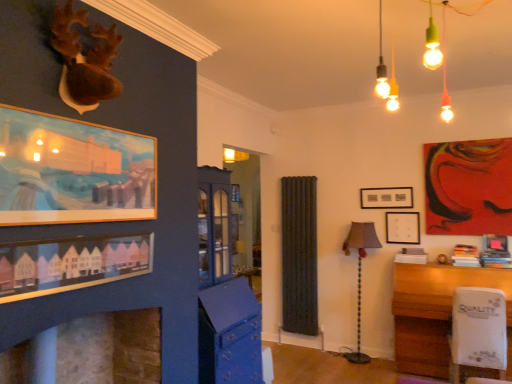
Question: From a real-world perspective, does stone fireplace at lower left sit lower than matte black picture frame at center, which is the third picture frame from right to left?

Choices:
 (A) no
 (B) yes

Answer: (B)

Question: Is stone fireplace at lower left outside matte black picture frame at center, acting as the fifth picture frame starting from the front?

Choices:
 (A) yes
 (B) no

Answer: (A)

Question: Is stone fireplace at lower left aimed at matte black picture frame at center, acting as the fifth picture frame starting from the front?

Choices:
 (A) yes
 (B) no

Answer: (B)

Question: Is the depth of stone fireplace at lower left greater than that of matte black picture frame at center, the 3th picture frame when ordered from left to right?

Choices:
 (A) yes
 (B) no

Answer: (B)

Question: Can you confirm if stone fireplace at lower left is bigger than matte black picture frame at center, the 3th picture frame when ordered from left to right?

Choices:
 (A) no
 (B) yes

Answer: (B)

Question: Can you confirm if stone fireplace at lower left is wider than matte black picture frame at center, the first picture frame viewed from the back?

Choices:
 (A) yes
 (B) no

Answer: (A)

Question: Can you confirm if stone fireplace at lower left is shorter than wooden framed painting at upper left, marked as the second picture frame in a front-to-back arrangement?

Choices:
 (A) yes
 (B) no

Answer: (A)

Question: Is stone fireplace at lower left behind wooden framed painting at upper left, placed as the fifth picture frame when sorted from right to left?

Choices:
 (A) yes
 (B) no

Answer: (A)

Question: From the image's perspective, would you say stone fireplace at lower left is positioned over wooden framed painting at upper left, the fourth picture frame when ordered from back to front?

Choices:
 (A) no
 (B) yes

Answer: (A)

Question: From a real-world perspective, is stone fireplace at lower left on wooden framed painting at upper left, placed as the fifth picture frame when sorted from right to left?

Choices:
 (A) no
 (B) yes

Answer: (A)

Question: Is stone fireplace at lower left positioned far away from wooden framed painting at upper left, placed as the fifth picture frame when sorted from right to left?

Choices:
 (A) no
 (B) yes

Answer: (A)

Question: Can you confirm if stone fireplace at lower left is taller than wooden framed painting at upper left, acting as the first picture frame starting from the left?

Choices:
 (A) no
 (B) yes

Answer: (A)

Question: Is the position of wooden framed painting at upper left, placed as the fifth picture frame when sorted from right to left, less distant than that of white plastic swivel chair at lower right?

Choices:
 (A) yes
 (B) no

Answer: (A)